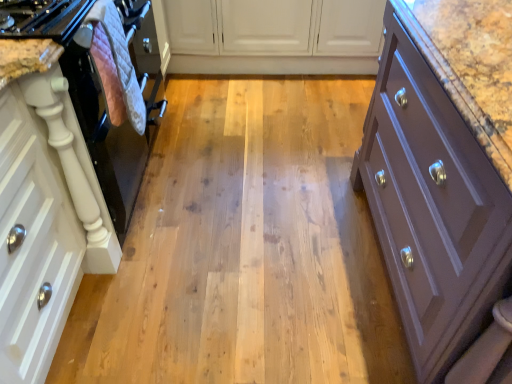
Question: From a real-world perspective, is white matte cabinet at center, the second cabinetry from the left, below black glossy oven at left?

Choices:
 (A) no
 (B) yes

Answer: (B)

Question: Does white matte cabinet at center, which is the 2th cabinetry in right-to-left order, come behind black glossy oven at left?

Choices:
 (A) yes
 (B) no

Answer: (A)

Question: Is white matte cabinet at center, the second cabinetry from the left, not inside black glossy oven at left?

Choices:
 (A) yes
 (B) no

Answer: (A)

Question: Can you confirm if white matte cabinet at center, which is the 2th cabinetry in right-to-left order, is positioned to the left of black glossy oven at left?

Choices:
 (A) yes
 (B) no

Answer: (B)

Question: Is white matte cabinet at center, the second cabinetry from the left, smaller than black glossy oven at left?

Choices:
 (A) yes
 (B) no

Answer: (A)

Question: Is white matte cabinet at center, which is the 2th cabinetry in right-to-left order, closer to camera compared to black glossy oven at left?

Choices:
 (A) no
 (B) yes

Answer: (A)

Question: Does purple matte cabinet at right, the 3th cabinetry positioned from the left, appear on the left side of pink quilted oven mitt at left?

Choices:
 (A) yes
 (B) no

Answer: (B)

Question: Does purple matte cabinet at right, the 1th cabinetry when ordered from right to left, have a greater width compared to pink quilted oven mitt at left?

Choices:
 (A) yes
 (B) no

Answer: (A)

Question: From the image's perspective, is purple matte cabinet at right, the 3th cabinetry positioned from the left, over pink quilted oven mitt at left?

Choices:
 (A) no
 (B) yes

Answer: (A)

Question: Is purple matte cabinet at right, the 1th cabinetry when ordered from right to left, far away from pink quilted oven mitt at left?

Choices:
 (A) yes
 (B) no

Answer: (B)

Question: From a real-world perspective, is purple matte cabinet at right, the 3th cabinetry positioned from the left, beneath pink quilted oven mitt at left?

Choices:
 (A) no
 (B) yes

Answer: (B)

Question: Can you confirm if purple matte cabinet at right, the 1th cabinetry when ordered from right to left, is bigger than pink quilted oven mitt at left?

Choices:
 (A) yes
 (B) no

Answer: (A)

Question: Can you confirm if pink quilted oven mitt at left is shorter than white matte cabinet at left, which is counted as the third cabinetry, starting from the right?

Choices:
 (A) yes
 (B) no

Answer: (A)